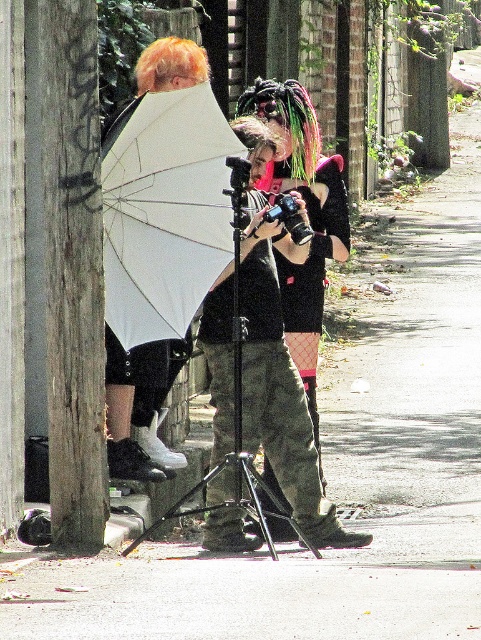
Question: Where is weathered wood pole at left located in relation to white matte umbrella at upper center in the image?

Choices:
 (A) below
 (B) above

Answer: (A)

Question: Does white matte umbrella at upper center have a greater width compared to matte black tripod at center?

Choices:
 (A) yes
 (B) no

Answer: (B)

Question: Which of the following is the farthest from the observer?

Choices:
 (A) white matte umbrella at upper center
 (B) weathered wood pole at left
 (C) matte black tripod at center

Answer: (A)

Question: Is the position of white matte umbrella at upper center less distant than that of fishnet stockings at center?

Choices:
 (A) no
 (B) yes

Answer: (B)

Question: Which object is farther from the camera taking this photo?

Choices:
 (A) fishnet stockings at center
 (B) weathered wood pole at left

Answer: (A)

Question: Which of these objects is positioned farthest from the fishnet stockings at center?

Choices:
 (A) matte black tripod at center
 (B) white matte umbrella at upper center

Answer: (A)